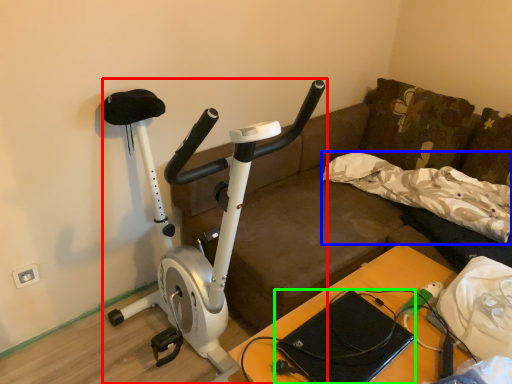
Question: Which is farther away from stationary bicycle (highlighted by a red box)? pillow (highlighted by a blue box) or laptop (highlighted by a green box)?

Choices:
 (A) pillow
 (B) laptop

Answer: (A)